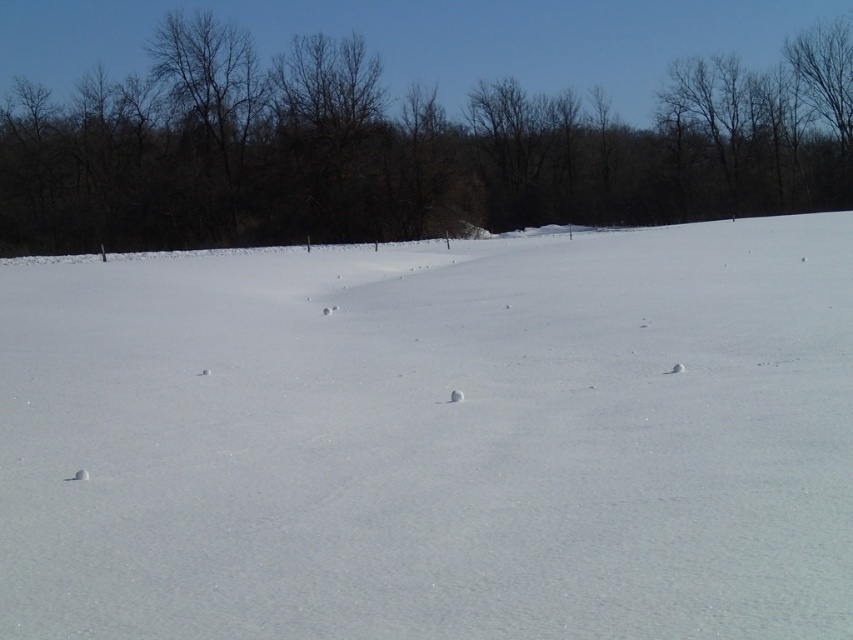
You are standing at the point marked by coordinates point (434, 438) and want to walk towards the dense line of trees in the background. Which direction should you face to walk directly towards the trees?

You should face north because the dense line of trees in the background is located north of the point (434, 438).

You are standing in the winter landscape and notice the white snow at center and the brown leafless trees at upper center. Which object is positioned higher in the image?

The brown leafless trees at upper center are positioned higher in the image than the white snow at center.